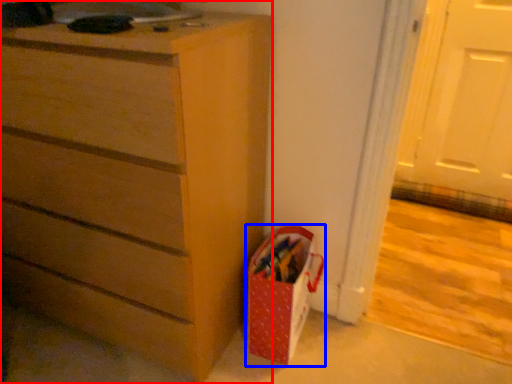
Question: Which point is further to the camera, chest of drawers (highlighted by a red box) or gift bag (highlighted by a blue box)?

Choices:
 (A) chest of drawers
 (B) gift bag

Answer: (B)